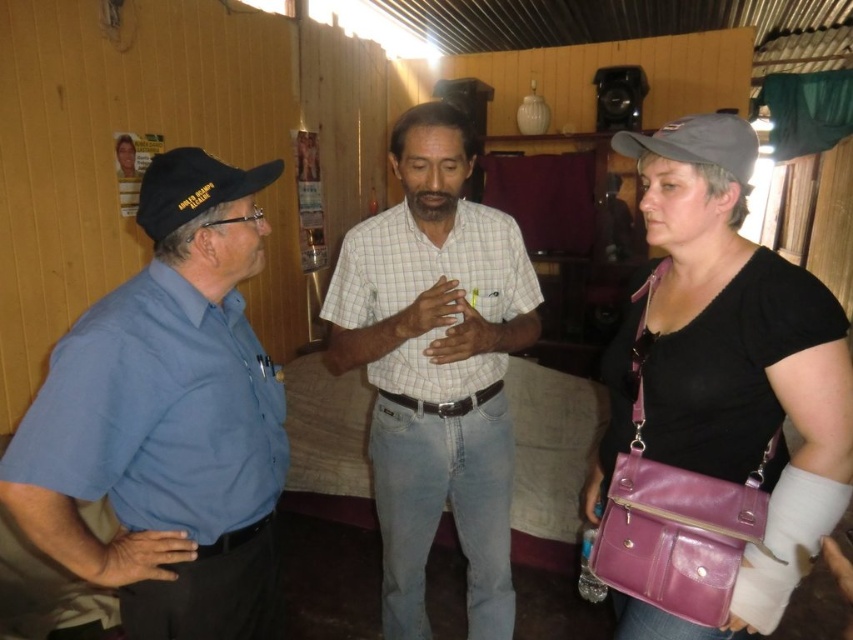
Is blue cotton shirt at left wider than white checkered shirt at center?

No.

Does blue cotton shirt at left have a larger size compared to white checkered shirt at center?

No.

Identify the location of blue cotton shirt at left. (167, 420).

Between point (822, 310) and point (480, 316), which one is positioned behind?

Point (480, 316)

Where is `purple leather bag at center right`? purple leather bag at center right is located at coordinates (727, 368).

Consider the image. Can you confirm if purple leather bag at center right is taller than black fabric baseball cap at left?

Indeed, purple leather bag at center right has a greater height compared to black fabric baseball cap at left.

What do you see at coordinates (727, 368) in the screenshot? The image size is (853, 640). I see `purple leather bag at center right` at bounding box center [727, 368].

The width and height of the screenshot is (853, 640). I want to click on purple leather bag at center right, so click(727, 368).